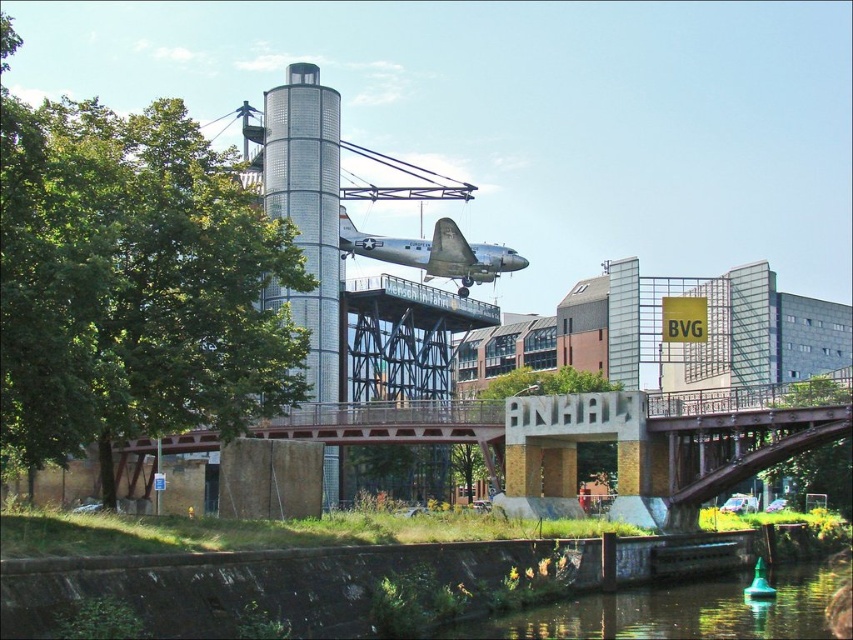
Consider the image. Does brown metal bridge at center have a greater height compared to silver metallic airplane at center?

No.

Between point (395, 419) and point (384, 259), which one is positioned behind?

Point (384, 259)

You are a GUI agent. You are given a task and a screenshot of the screen. Output one action in this format:
    pyautogui.click(x=<x>, y=<y>)
    Task: Click on the brown metal bridge at center
    
    Given the screenshot: What is the action you would take?
    pyautogui.click(x=592, y=435)

Who is shorter, brown metal bridge at center or green water at lower center?

green water at lower center is shorter.

Is point (563, 474) less distant than point (801, 566)?

Yes, point (563, 474) is in front of point (801, 566).

Between point (526, 488) and point (827, 563), which one is positioned behind?

Point (827, 563)

The image size is (853, 640). In order to click on brown metal bridge at center in this screenshot , I will do `click(592, 435)`.

Can you confirm if green water at lower center is wider than silver metallic airplane at center?

Indeed, green water at lower center has a greater width compared to silver metallic airplane at center.

Is green water at lower center to the left of silver metallic airplane at center from the viewer's perspective?

Incorrect, green water at lower center is not on the left side of silver metallic airplane at center.

Is point (704, 595) positioned in front of point (395, 260)?

Yes, it is.

The height and width of the screenshot is (640, 853). I want to click on green water at lower center, so click(x=682, y=609).